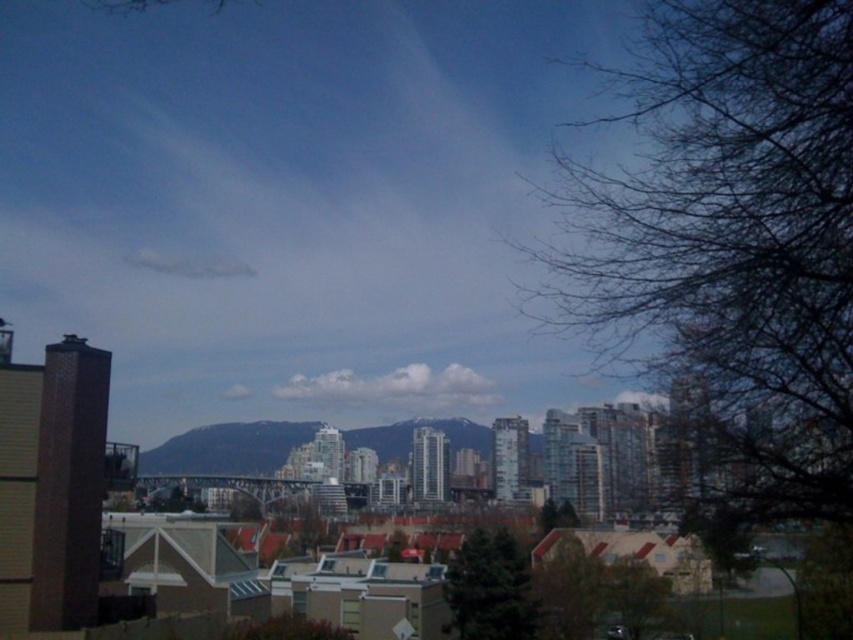
You are standing at the center of the image and want to locate the green leafy tree at lower right. According to the coordinates provided, in which direction should you move to find it?

The green leafy tree at lower right is located at coordinates point [635,596]. Since you are at the center, you should move towards the lower right direction to find it.

You are standing at the bridge in the midground of the urban landscape. You see two points marked in the scene. The first point is at coordinates point [576,625] and the second is at point [608,570]. Which point is closer to you?

Point [576,625] is in front of point [608,570], so the first point is closer to you.